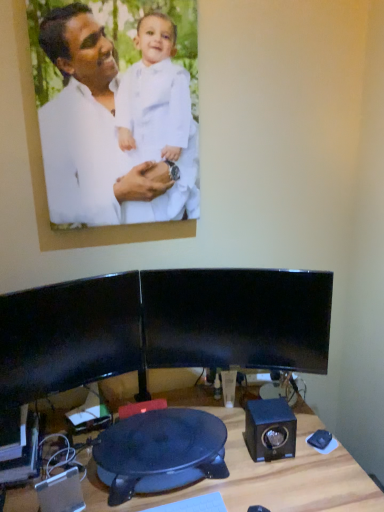
Locate an element on the screen. Image resolution: width=384 pixels, height=512 pixels. vacant area located to the right-hand side of black plastic keyboard at lower center is located at coordinates (246, 492).